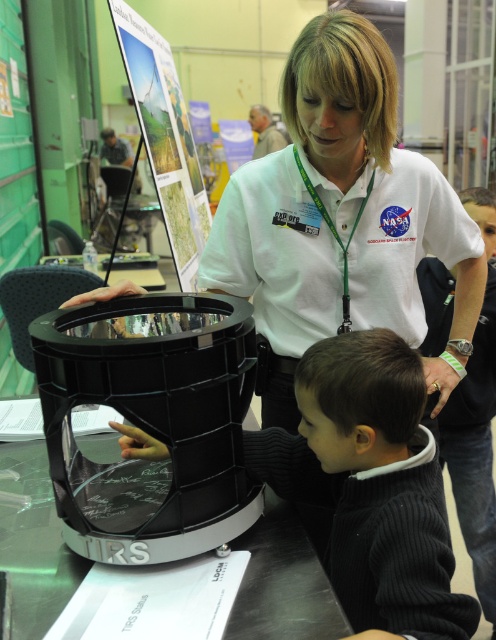
Question: Does white smooth shirt at center have a larger size compared to dark gray ribbed sweater at lower center?

Choices:
 (A) no
 (B) yes

Answer: (B)

Question: Does white smooth shirt at center have a smaller size compared to dark gray ribbed sweater at lower center?

Choices:
 (A) yes
 (B) no

Answer: (B)

Question: Does white smooth shirt at center have a larger size compared to dark gray ribbed sweater at lower center?

Choices:
 (A) no
 (B) yes

Answer: (B)

Question: Among these points, which one is nearest to the camera?

Choices:
 (A) (335, 84)
 (B) (311, 404)

Answer: (B)